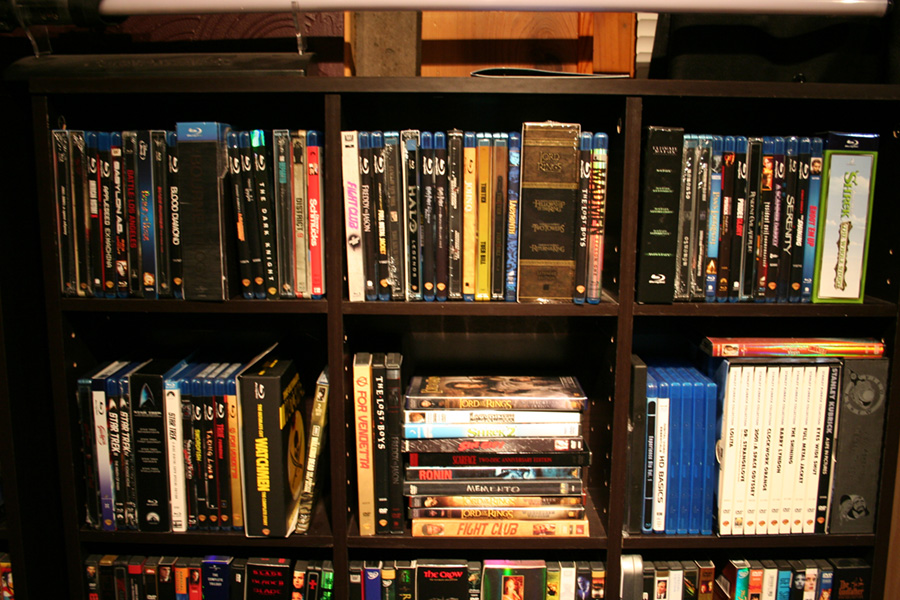
You are a GUI agent. You are given a task and a screenshot of the screen. Output one action in this format:
    pyautogui.click(x=<x>, y=<y>)
    Task: Click on the red dvd cases
    
    Given the screenshot: What is the action you would take?
    pyautogui.click(x=796, y=346), pyautogui.click(x=756, y=583), pyautogui.click(x=195, y=581), pyautogui.click(x=315, y=225)